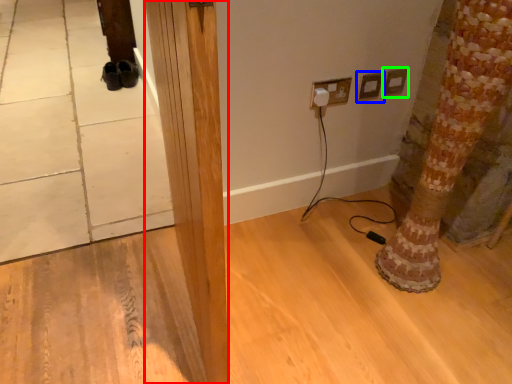
Question: Based on their relative distances, which object is nearer to pillar (highlighted by a red box)? Choose from electric outlet (highlighted by a blue box) and electric outlet (highlighted by a green box).

Choices:
 (A) electric outlet
 (B) electric outlet

Answer: (A)